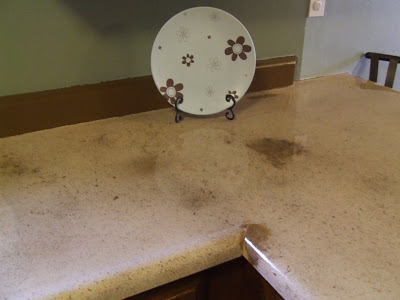
Locate an element on the screen. This screenshot has width=400, height=300. back wall is located at coordinates (27, 48), (118, 32), (275, 20), (341, 18), (377, 16).